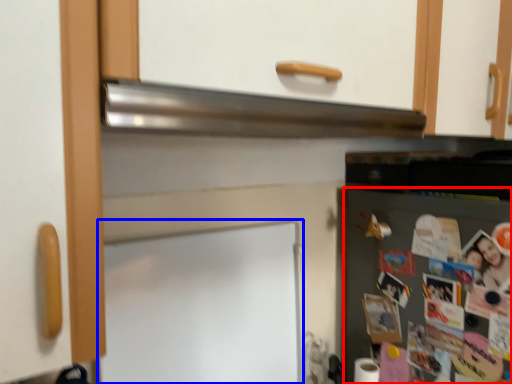
Question: Which object appears farthest to the camera in this image, fridge (highlighted by a red box) or bulletin board (highlighted by a blue box)?

Choices:
 (A) fridge
 (B) bulletin board

Answer: (A)